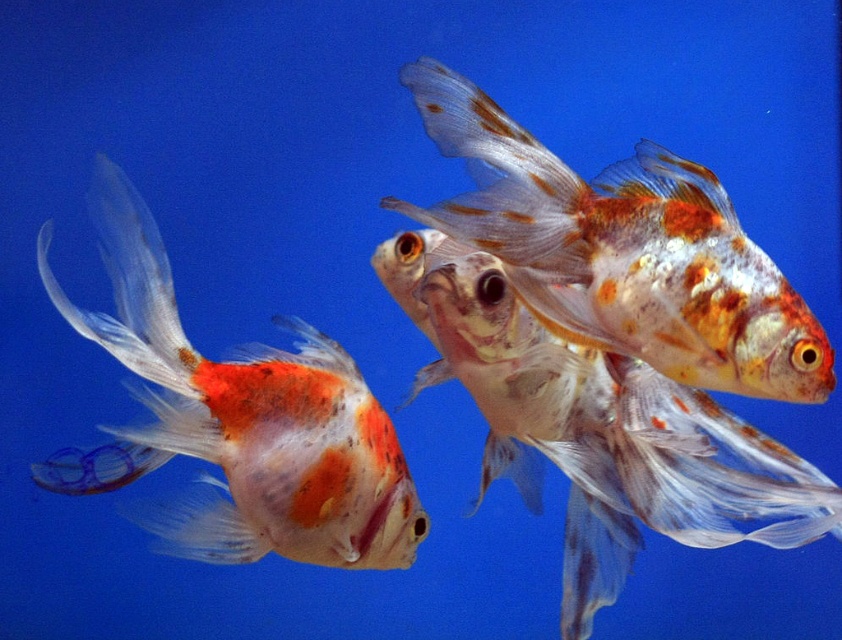
Which is in front, point (624, 497) or point (763, 364)?

Positioned in front is point (763, 364).

Between translucent orange goldfish at center and speckled orange and white goldfish at center, which one has more height?

translucent orange goldfish at center

Between point (661, 420) and point (729, 328), which one is positioned behind?

Point (661, 420)

Identify the location of translucent orange goldfish at center. (594, 428).

Who is shorter, translucent orange goldfish at left or speckled orange and white goldfish at center?

With less height is speckled orange and white goldfish at center.

Is translucent orange goldfish at left shorter than speckled orange and white goldfish at center?

Incorrect, translucent orange goldfish at left's height does not fall short of speckled orange and white goldfish at center's.

Where is `translucent orange goldfish at left`? This screenshot has height=640, width=842. translucent orange goldfish at left is located at coordinates (236, 420).

I want to click on translucent orange goldfish at left, so click(x=236, y=420).

Between translucent orange goldfish at left and translucent orange goldfish at center, which one is positioned lower?

translucent orange goldfish at left is below.

Is translucent orange goldfish at left further to the viewer compared to translucent orange goldfish at center?

No, translucent orange goldfish at left is in front of translucent orange goldfish at center.

The image size is (842, 640). In order to click on translucent orange goldfish at left in this screenshot , I will do `click(236, 420)`.

Image resolution: width=842 pixels, height=640 pixels. Identify the location of translucent orange goldfish at left. pyautogui.click(x=236, y=420).